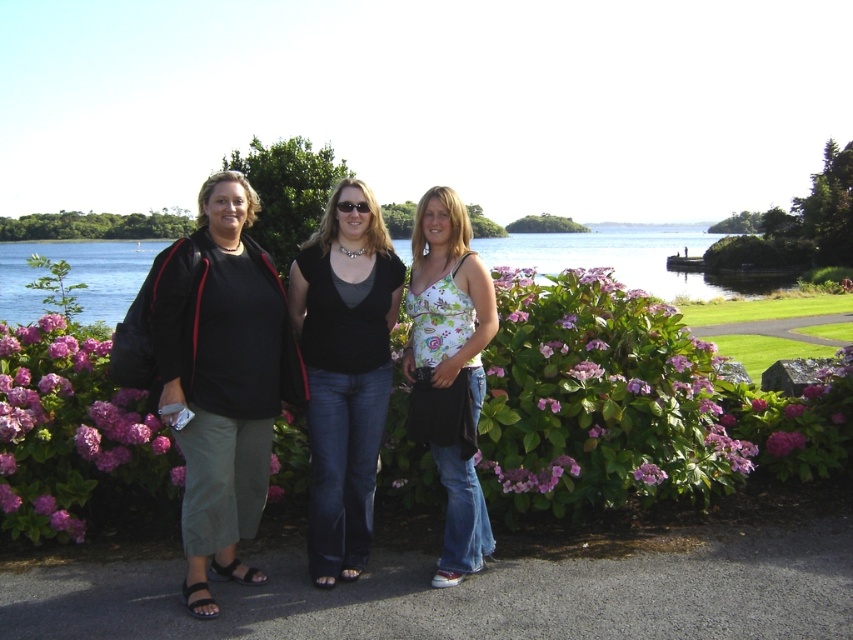
You are a photographer standing at the far left of the scene. You want to capture a photo of the matte black top at center and the blue water at center in the same frame. Given that your camera has a maximum focal length of 50 meters, will you be able to include both objects in the photo?

The matte black top at center and blue water at center are 36.88 meters apart. Since the camera can capture up to 50 meters, you can include both objects in the photo as the distance between them is within the camera range.

You are a photographer trying to capture the scene with the matte black top at center and the blue water at center. Based on their heights, which object should you focus on first to ensure they are both in frame?

The matte black top at center is not as tall as blue water at center, so you should focus on the taller blue water at center first to ensure both are in frame.